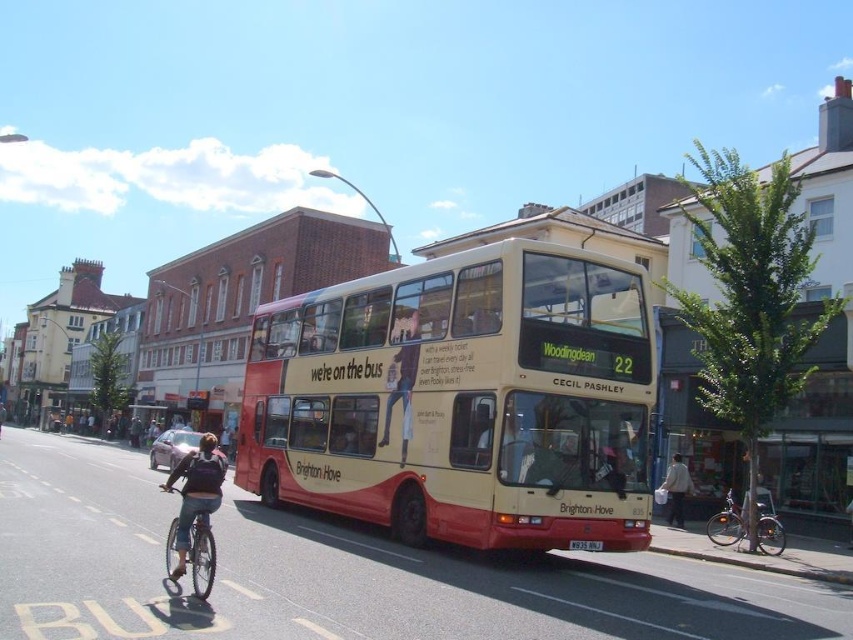
You are a delivery person who needs to place a 3.5 meter long package between the silver metallic bicycle at lower right and the black plastic license plate at center. Is there enough space?

The distance between the silver metallic bicycle at lower right and the black plastic license plate at center is 6.74 meters, which is longer than the 3.5 meter package. There is enough space to place the package between them.